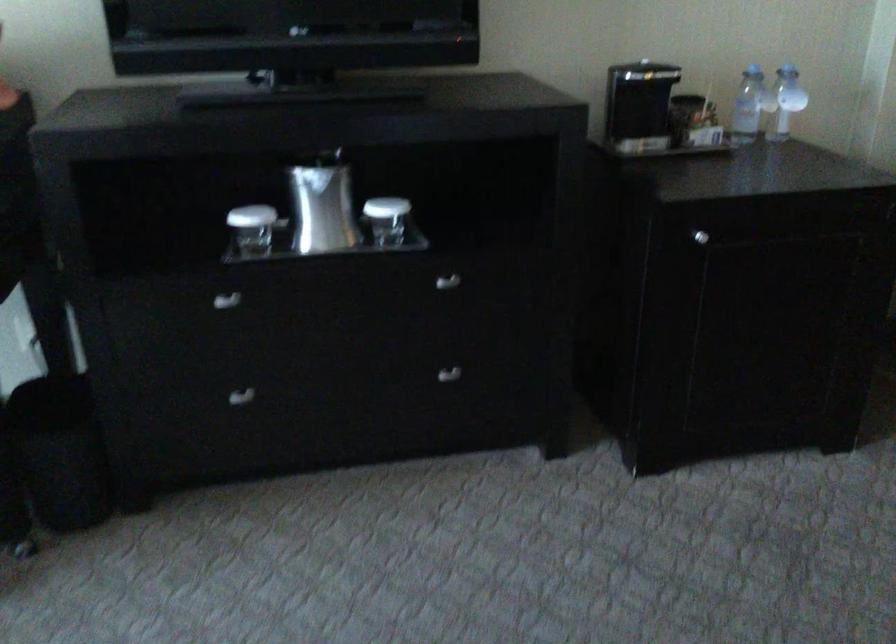
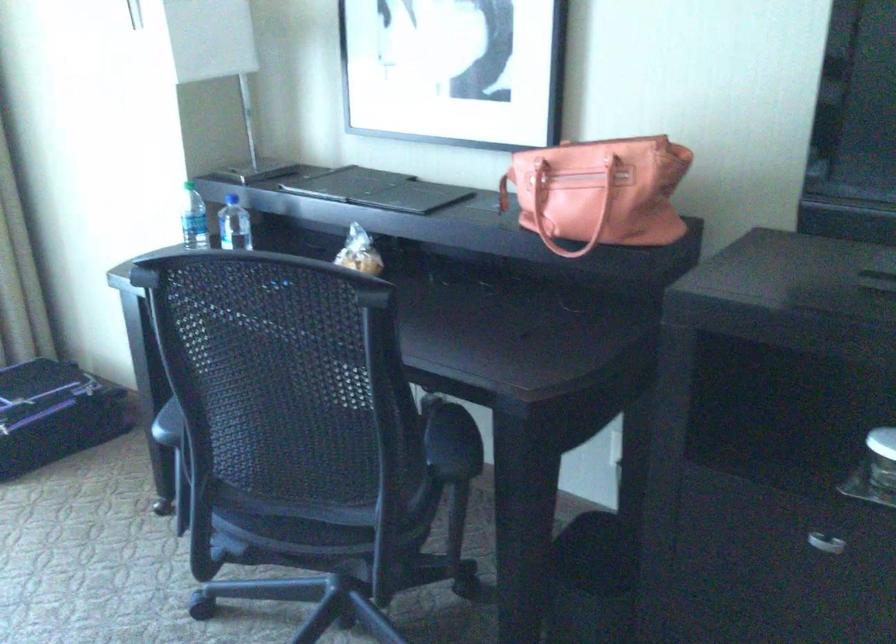
Question: The camera is either moving clockwise (left) or counter-clockwise (right) around the object. The first image is from the beginning of the video and the second image is from the end. Is the camera moving left or right when shooting the video?

Choices:
 (A) Left
 (B) Right

Answer: (B)